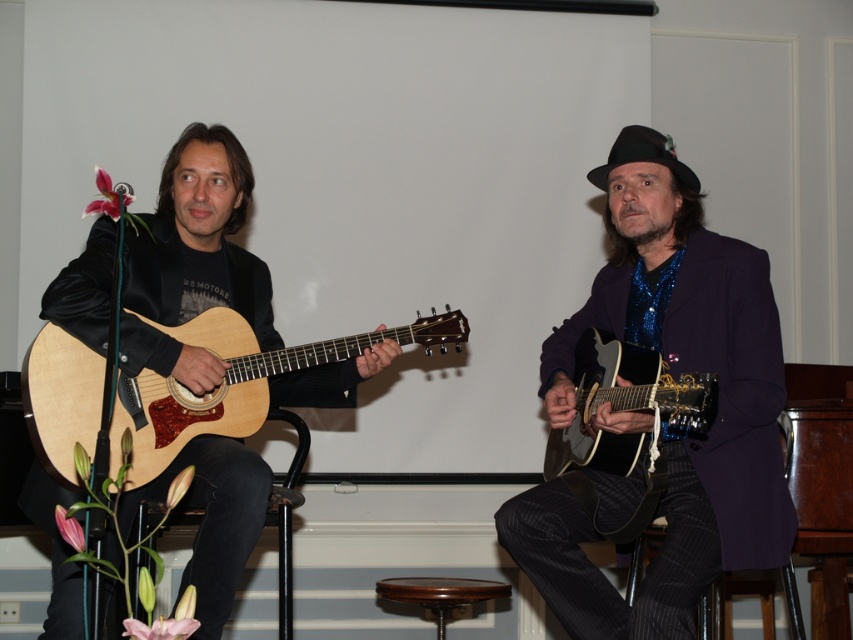
Question: Is the position of mahogany wood bar stool at center more distant than that of black leather bar stool at lower left?

Choices:
 (A) yes
 (B) no

Answer: (A)

Question: Among these objects, which one is nearest to the camera?

Choices:
 (A) natural wood acoustic guitar at left
 (B) wooden acoustic guitar at right
 (C) mahogany wood bar stool at center
 (D) black felt cowboy hat at upper right

Answer: (B)

Question: Is natural wood acoustic guitar at left smaller than wooden acoustic guitar at right?

Choices:
 (A) no
 (B) yes

Answer: (A)

Question: Can you confirm if natural wood acoustic guitar at left is thinner than black felt cowboy hat at upper right?

Choices:
 (A) yes
 (B) no

Answer: (B)

Question: Which point is closer to the camera?

Choices:
 (A) (714, 388)
 (B) (695, 182)
 (C) (300, 500)
 (D) (202, 433)

Answer: (A)

Question: Among these points, which one is farthest from the camera?

Choices:
 (A) pyautogui.click(x=286, y=556)
 (B) pyautogui.click(x=602, y=392)

Answer: (A)